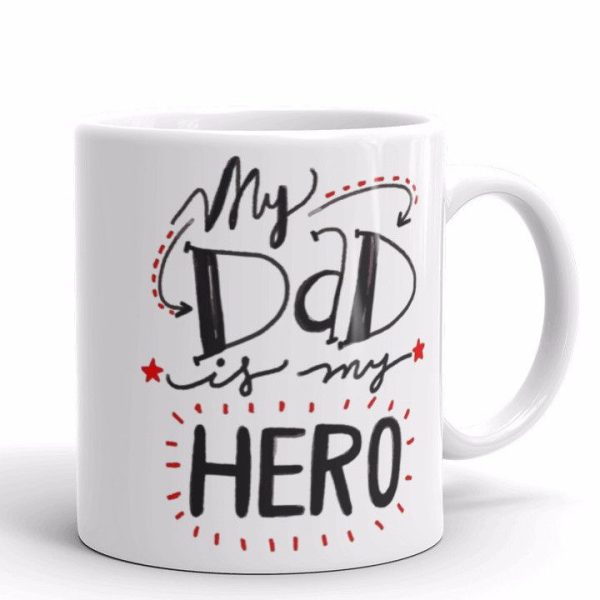
The image size is (600, 600). Identify the location of handle. (568, 288).